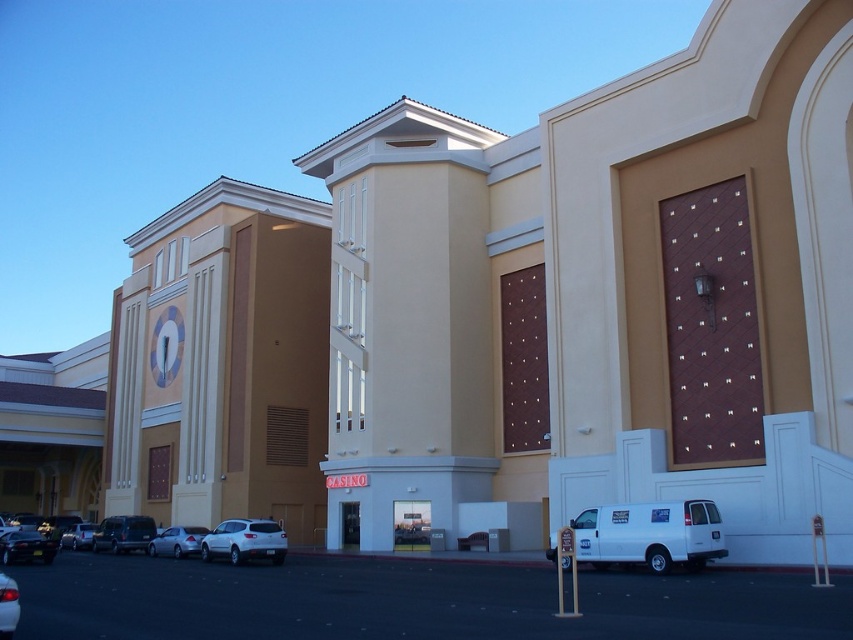
Question: Which object appears closest to the camera in this image?

Choices:
 (A) white matte van at lower right
 (B) white matte car at center

Answer: (A)

Question: Can you confirm if black asphalt parking lot at lower center is positioned to the right of white matte van at lower right?

Choices:
 (A) yes
 (B) no

Answer: (B)

Question: Is metallic gray suv at lower left wider than silver metallic sedan at lower left?

Choices:
 (A) yes
 (B) no

Answer: (A)

Question: Which object is positioned closest to the black asphalt parking lot at lower center?

Choices:
 (A) silver metallic sedan at lower left
 (B) shiny black sedan at lower left
 (C) white matte van at lower right
 (D) shiny silver sedan at lower left

Answer: (C)

Question: Which point is closer to the camera?

Choices:
 (A) (154, 545)
 (B) (138, 532)

Answer: (A)

Question: Can you confirm if white matte van at lower right is thinner than metallic gray suv at lower left?

Choices:
 (A) yes
 (B) no

Answer: (A)